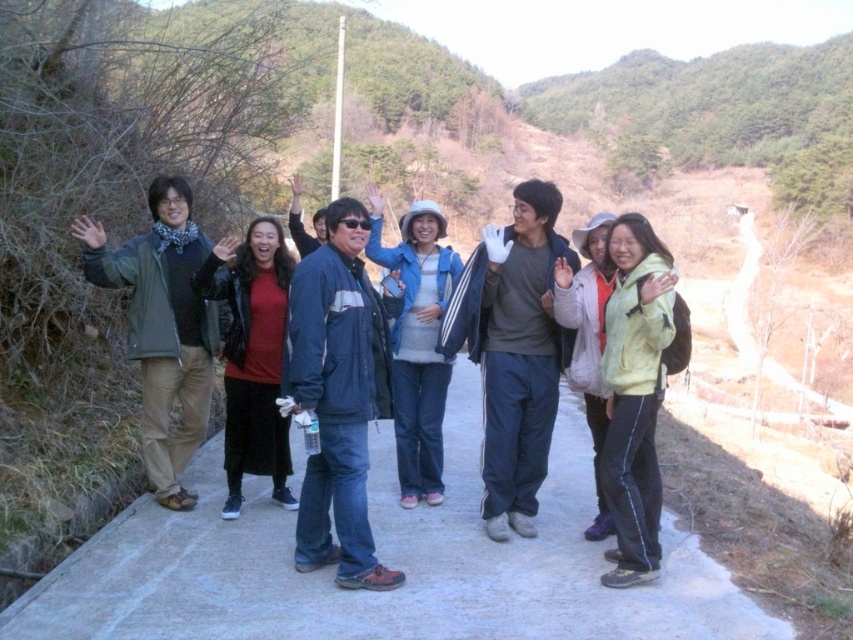
Question: Among these points, which one is farthest from the camera?

Choices:
 (A) (270, 397)
 (B) (187, 451)
 (C) (328, 330)
 (D) (433, 458)

Answer: (B)

Question: Is concrete at center above denim jacket at center?

Choices:
 (A) no
 (B) yes

Answer: (A)

Question: Is blue denim jacket at center to the left of denim jacket at center from the viewer's perspective?

Choices:
 (A) yes
 (B) no

Answer: (A)

Question: Estimate the real-world distances between objects in this image. Which object is farther from the blue denim jacket at center?

Choices:
 (A) denim jacket at center
 (B) concrete at center
 (C) matte green jacket at left

Answer: (C)

Question: In this image, where is concrete at center located relative to blue denim jacket at center?

Choices:
 (A) left
 (B) right

Answer: (B)

Question: Estimate the real-world distances between objects in this image. Which object is closer to the matte green jacket at left?

Choices:
 (A) concrete at center
 (B) denim jacket at center
 (C) matte black jacket at center
 (D) blue denim jacket at center

Answer: (C)